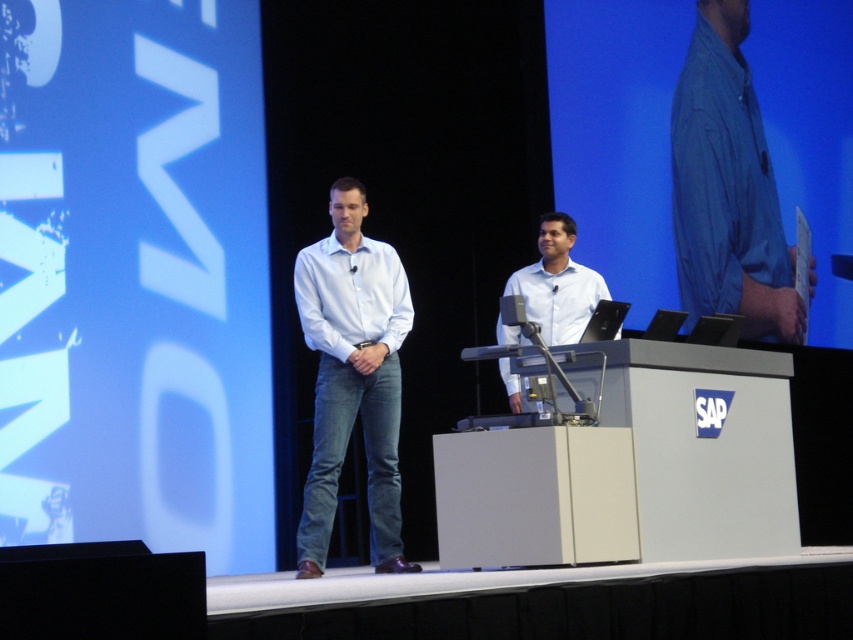
You are an event organizer who needs to ensure proper seating arrangements for the presenters. Both presenters are wearing white shirts. The one on the left is wearing a white cotton shirt at center, and the one on the right is wearing a white smooth shirt at center. Which presenter should be seated in the front row for better visibility, considering their shirt sizes?

The presenter wearing the white cotton shirt at center should be seated in the front row because it has a larger size compared to the white smooth shirt at center, making it more visible to the audience.

You are an event photographer at the SAP stage setup. You need to capture a clear photo of both the white cotton shirt at center and the white smooth shirt at center. Which shirt should you focus on first to ensure both are in focus?

You should focus on the white cotton shirt at center first since it is closer to the viewer. By focusing on the closer shirt, the depth of field may also capture the white smooth shirt at center in focus as well.

You are attending a SAP event and notice two presenters. One is wearing a blue cotton shirt at upper right and the other a light blue shirt at center. Which presenter is standing to the right of the other?

The blue cotton shirt at upper right is positioned on the right side of the light blue shirt at center, so the presenter in the blue cotton shirt at upper right is to the right of the one in the light blue shirt at center.